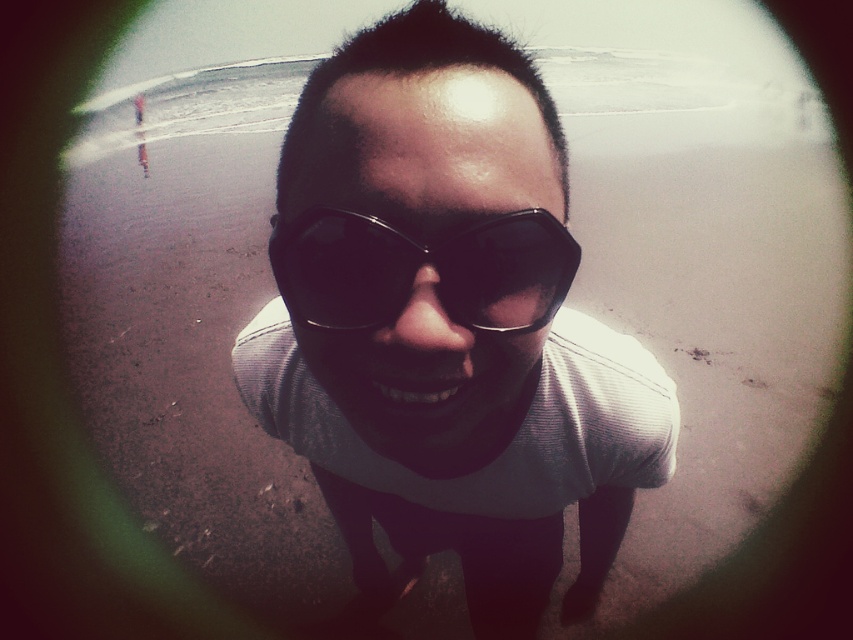
You are a photographer trying to capture the perfect shot of the person on the beach. You notice the matte black sunglasses at center and the black plastic goggles at center. Which object is located lower on the person?

The matte black sunglasses at center is positioned under black plastic goggles at center, so the matte black sunglasses at center is lower.

You are a photographer trying to adjust the focus of your camera. You want to focus on the black plastic goggles at center without blurring the matte black sunglasses at center. Is this possible given their positions?

The black plastic goggles at center is behind matte black sunglasses at center, so focusing on the goggles will cause the sunglasses to be out of focus. Therefore, it is not possible to have both in focus simultaneously.

You are a photographer trying to capture a closeup of the person wearing both matte black sunglasses at center and black plastic goggles at center. Since you want to ensure both items are clearly visible, which item should you focus on to avoid blurring due to their size difference?

The matte black sunglasses at center is wider than the black plastic goggles at center, so you should focus on the matte black sunglasses at center to ensure its details are sharp since it occupies more space in the frame.